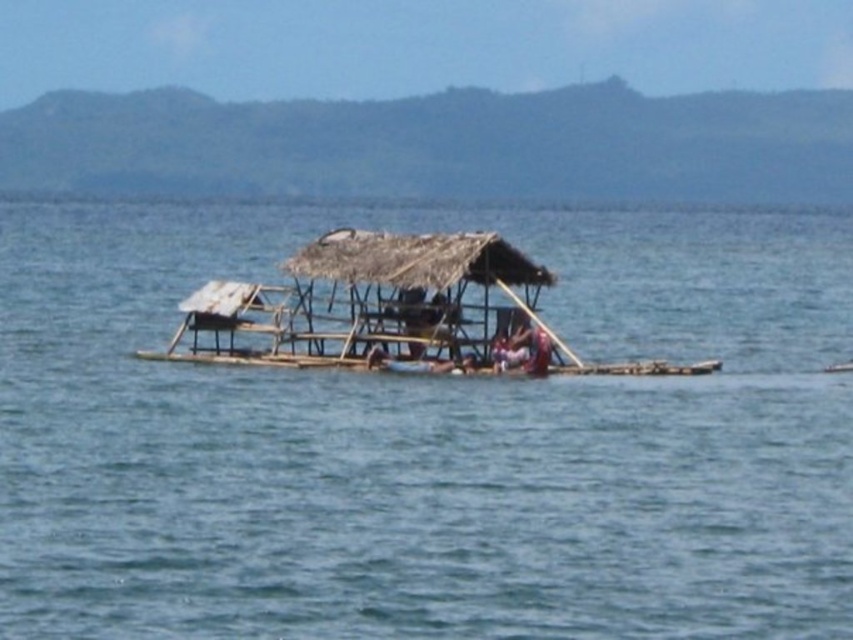
Can you confirm if bamboo raft at center is positioned to the left of bamboo paddle at center?

Yes, bamboo raft at center is to the left of bamboo paddle at center.

Does point (467, 364) lie in front of point (531, 312)?

Yes, it is in front of point (531, 312).

Is point (195, 310) positioned after point (502, 289)?

Yes, it is.

Locate an element on the screen. bamboo raft at center is located at coordinates (386, 310).

The width and height of the screenshot is (853, 640). Identify the location of pink fabric at center. (532, 348).

Which is behind, point (544, 372) or point (524, 305)?

Positioned behind is point (524, 305).

Does point (515, 340) lie behind point (532, 321)?

No, (515, 340) is closer to viewer.

At what (x,y) coordinates should I click in order to perform the action: click on pink fabric at center. Please return your answer as a coordinate pair (x, y). The image size is (853, 640). Looking at the image, I should click on (532, 348).

Does point (811, 548) come closer to viewer compared to point (561, 349)?

Yes, point (811, 548) is closer to viewer.

Is clear blue water at center positioned behind bamboo paddle at center?

No.

The image size is (853, 640). Identify the location of clear blue water at center. (427, 438).